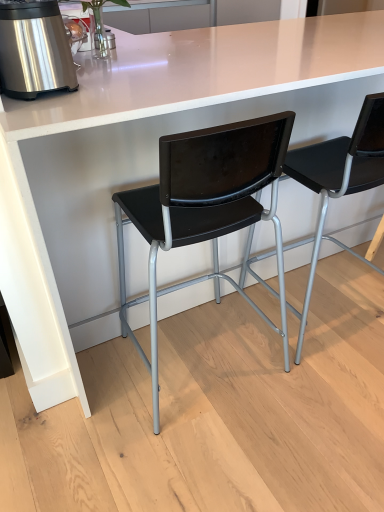
This screenshot has height=512, width=384. I want to click on vacant area that is in front of stainless steel appliance at left, so click(x=42, y=105).